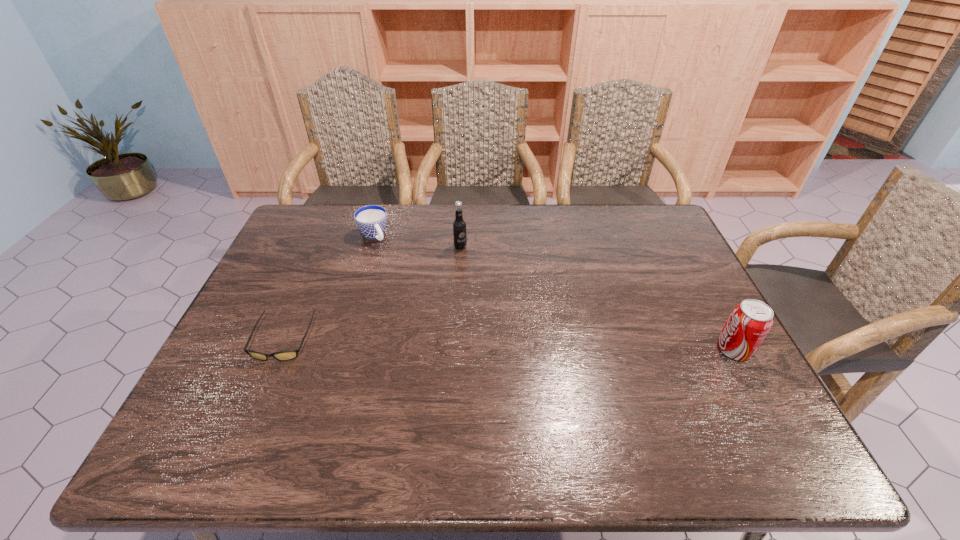
You are a GUI agent. You are given a task and a screenshot of the screen. Output one action in this format:
    pyautogui.click(x=<x>, y=<y>)
    Task: Click on the vacant area that satisfies the following two spatial constraints: 1. on the front side of the second object from left to right; 2. on the right side of the root beer
    
    Given the screenshot: What is the action you would take?
    pyautogui.click(x=371, y=247)